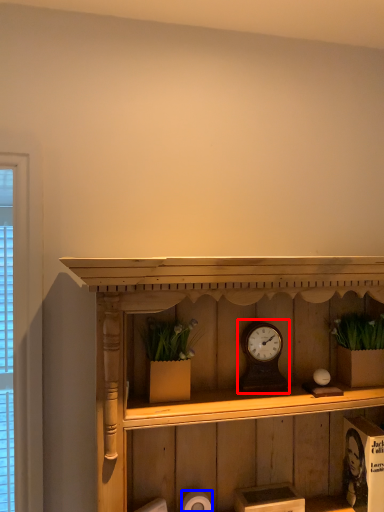
Question: Which object appears closest to the camera in this image, alarm clock (highlighted by a red box) or toilet paper (highlighted by a blue box)?

Choices:
 (A) alarm clock
 (B) toilet paper

Answer: (B)